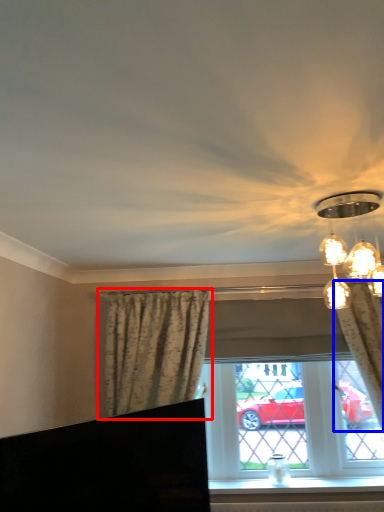
Question: Which object appears closest to the camera in this image, curtain (highlighted by a red box) or curtain (highlighted by a blue box)?

Choices:
 (A) curtain
 (B) curtain

Answer: (B)